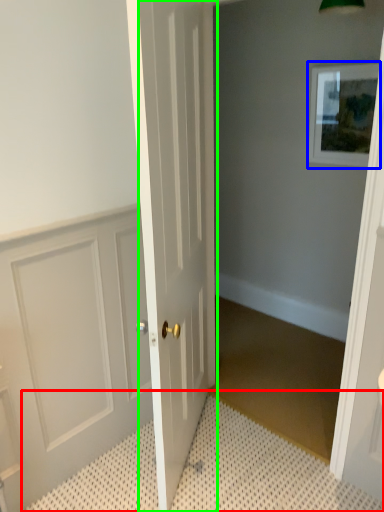
Question: Estimate the real-world distances between objects in this image. Which object is closer to bath mat (highlighted by a red box), picture frame (highlighted by a blue box) or door (highlighted by a green box)?

Choices:
 (A) picture frame
 (B) door

Answer: (B)